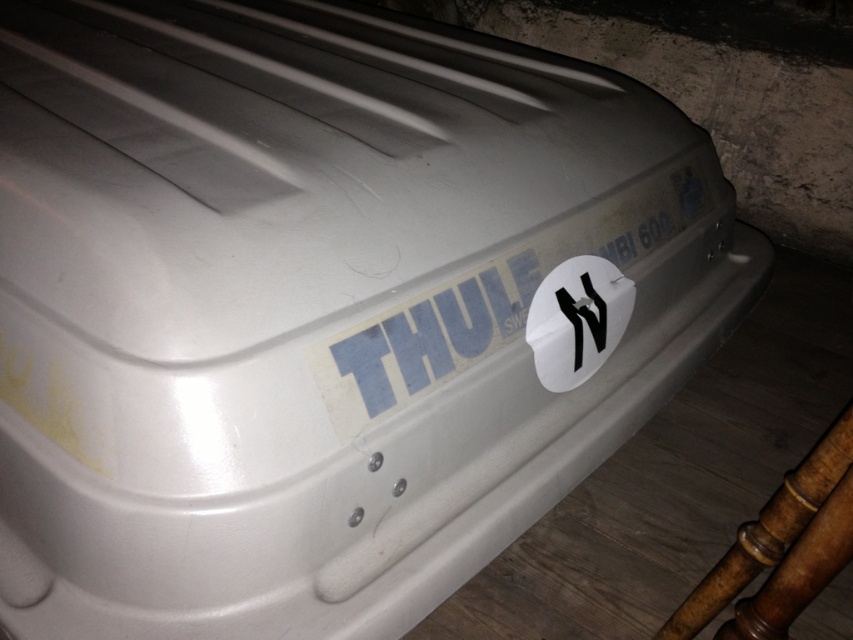
You are organizing a small event and need to place the brown wooden stool at lower right next to the white matte sticker at center. Based on their sizes, which one should you place first to ensure they fit properly?

The brown wooden stool at lower right has a smaller width than the white matte sticker at center, so you should place the white matte sticker at center first to accommodate its larger size and then position the brown wooden stool at lower right accordingly.

Looking at this image, you are standing 36 inches away from a THULE branded storage container. There is a brown wooden stool at lower right. Can you step onto the stool to reach the top of the container?

The brown wooden stool at lower right is 32.03 inches away from the camera. Since you are standing 36 inches away from the container, the stool is closer to you than the container. Therefore, you can step onto the brown wooden stool at lower right to reach the top of the container.